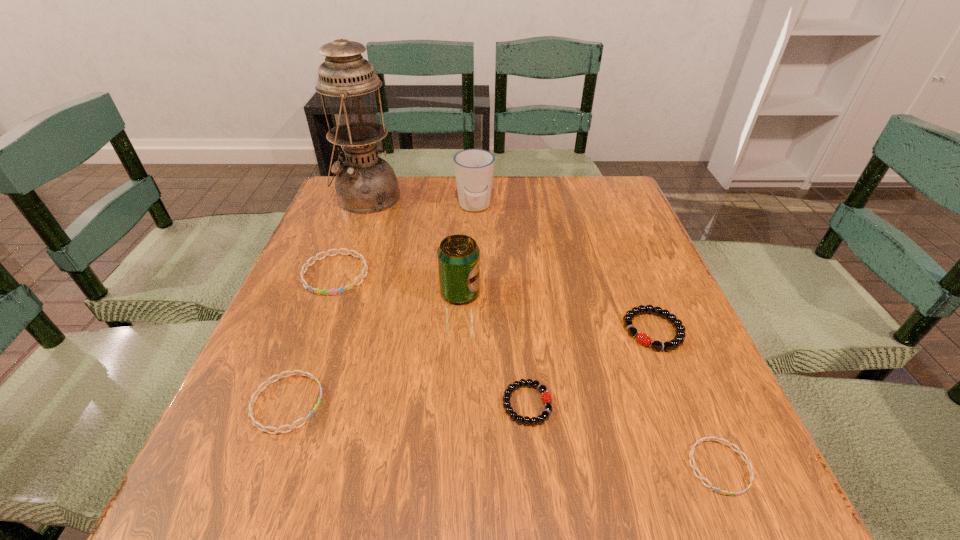
The height and width of the screenshot is (540, 960). I want to click on cup that is at the far edge, so click(x=474, y=168).

Where is `object at the near edge`? This screenshot has height=540, width=960. object at the near edge is located at coordinates (693, 466).

The height and width of the screenshot is (540, 960). In order to click on oil lamp that is at the left edge in this screenshot , I will do `click(365, 183)`.

Where is `object that is at the far left corner`? The width and height of the screenshot is (960, 540). object that is at the far left corner is located at coordinates (365, 183).

Where is `object located in the near right corner section of the desktop`? The width and height of the screenshot is (960, 540). object located in the near right corner section of the desktop is located at coordinates (693, 466).

The width and height of the screenshot is (960, 540). What are the coordinates of `vacant region at the far edge` in the screenshot? It's located at (525, 213).

In the image, there is a desktop. Identify the location of vacant space at the near edge. (406, 506).

Where is `blank space at the left edge of the desktop`? This screenshot has height=540, width=960. blank space at the left edge of the desktop is located at coordinates (x=325, y=239).

The height and width of the screenshot is (540, 960). In the image, there is a desktop. Identify the location of vacant space at the right edge. (591, 242).

Locate an element on the screen. The width and height of the screenshot is (960, 540). free point at the far right corner is located at coordinates (622, 218).